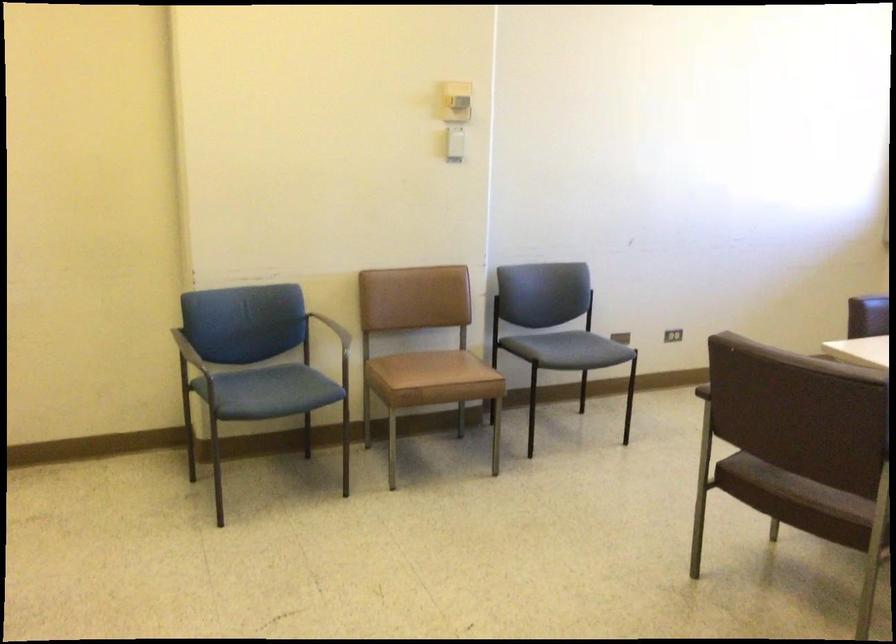
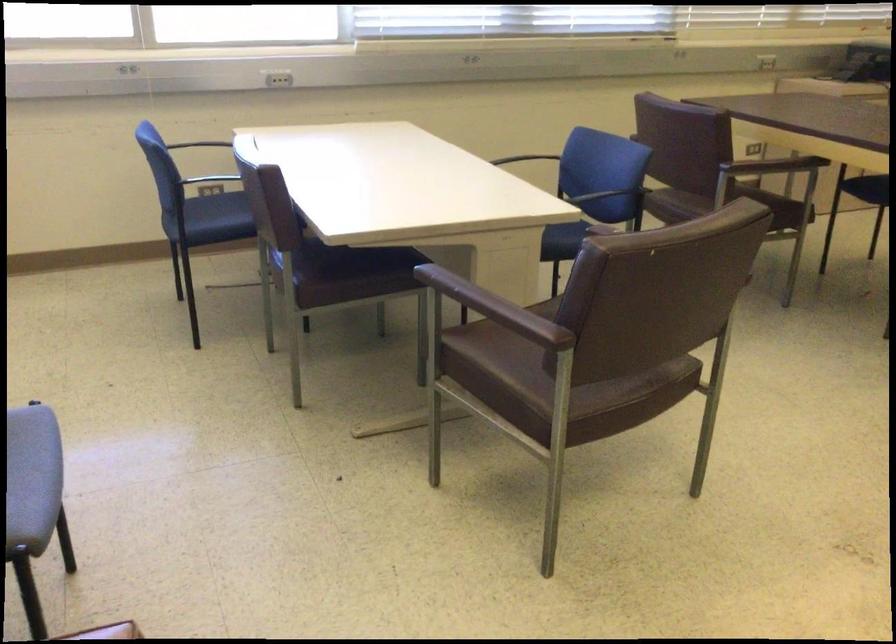
The point at (767, 477) is marked in the first image. Where is the corresponding point in the second image?

(588, 404)